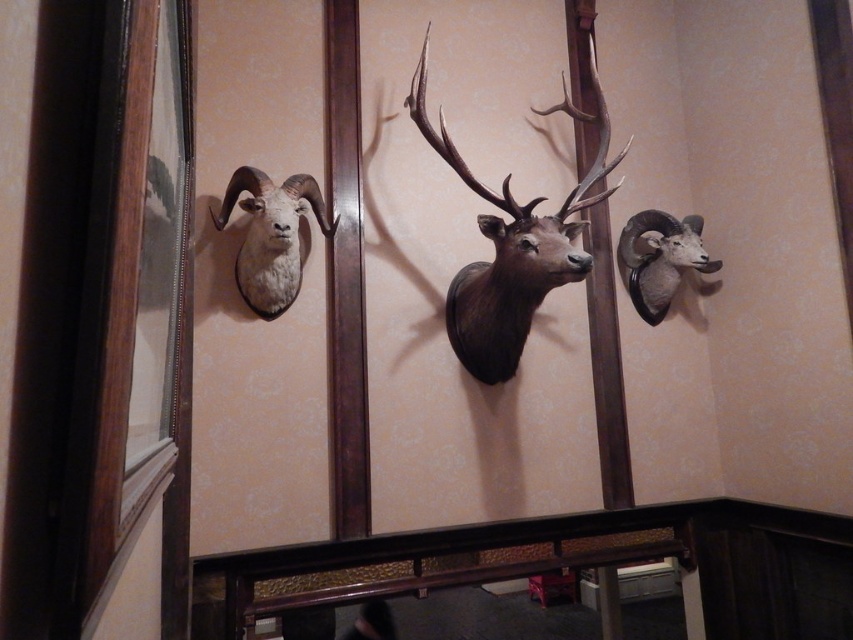
Does polished brown moose head at center have a greater height compared to white matte ram head at upper left?

Indeed, polished brown moose head at center has a greater height compared to white matte ram head at upper left.

Who is positioned more to the left, polished brown moose head at center or white matte ram head at upper left?

polished brown moose head at center is more to the left.

Is point (520, 236) positioned before point (672, 289)?

Yes, it is in front of point (672, 289).

This screenshot has height=640, width=853. Find the location of `polished brown moose head at center`. polished brown moose head at center is located at coordinates (512, 243).

The image size is (853, 640). Describe the element at coordinates (271, 236) in the screenshot. I see `white matte ram head at left` at that location.

Which of these two, white matte ram head at left or white matte ram head at upper left, stands shorter?

white matte ram head at upper left is shorter.

Does point (252, 269) lie behind point (653, 317)?

No, it is not.

You are a GUI agent. You are given a task and a screenshot of the screen. Output one action in this format:
    pyautogui.click(x=<x>, y=<y>)
    Task: Click on the white matte ram head at left
    Image resolution: width=853 pixels, height=640 pixels.
    Given the screenshot: What is the action you would take?
    pyautogui.click(x=271, y=236)

Can you confirm if polished brown moose head at center is positioned above white matte ram head at left?

Correct, polished brown moose head at center is located above white matte ram head at left.

Does point (462, 160) come behind point (263, 262)?

Yes.

Who is more distant from viewer, [585,116] or [296,253]?

Positioned behind is point [585,116].

Where is `polished brown moose head at center`? This screenshot has height=640, width=853. polished brown moose head at center is located at coordinates (512, 243).